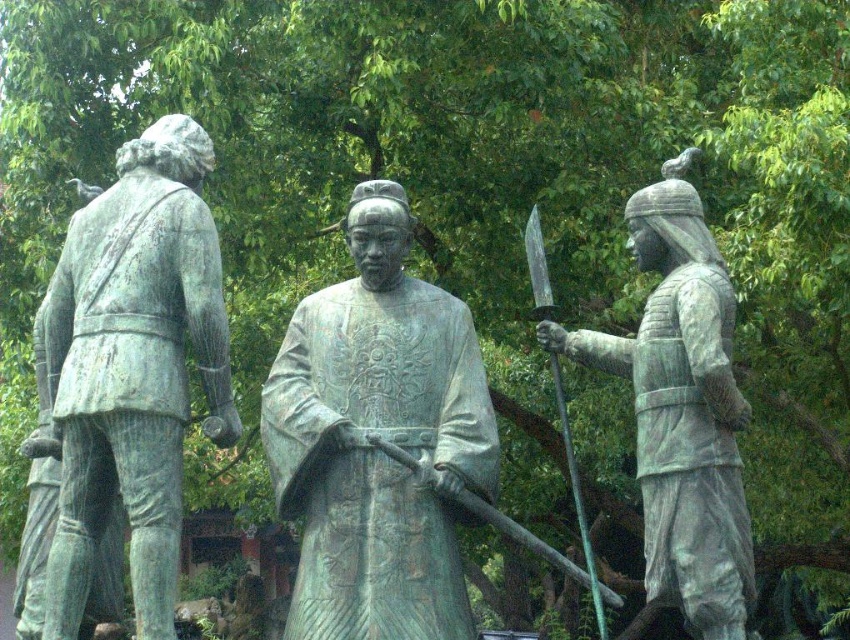
Question: Based on their relative distances, which object is farther from the green patina armor at right?

Choices:
 (A) polished steel sword at center right
 (B) green patina statue at left

Answer: (B)

Question: Does green patina statue at center have a smaller size compared to green patina armor at right?

Choices:
 (A) no
 (B) yes

Answer: (B)

Question: Considering the relative positions of green patina statue at center and polished steel sword at center right in the image provided, where is green patina statue at center located with respect to polished steel sword at center right?

Choices:
 (A) left
 (B) right

Answer: (A)

Question: Among these objects, which one is farthest from the camera?

Choices:
 (A) green patina armor at right
 (B) polished steel sword at center right
 (C) green patina statue at center
 (D) green patina statue at left

Answer: (B)

Question: Which of the following is the farthest from the observer?

Choices:
 (A) green patina statue at left
 (B) green patina statue at center

Answer: (B)

Question: Does green patina statue at left have a greater width compared to polished steel sword at center right?

Choices:
 (A) no
 (B) yes

Answer: (A)